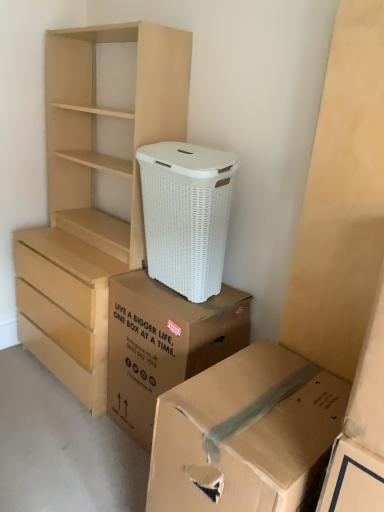
Question: Does cardboard box at lower right, the 1th box from the front, have a smaller size compared to white wicker laundry basket at center?

Choices:
 (A) yes
 (B) no

Answer: (B)

Question: Is cardboard box at lower right, the 1th box from the front, facing away from white wicker laundry basket at center?

Choices:
 (A) yes
 (B) no

Answer: (B)

Question: Can you confirm if cardboard box at lower right, acting as the second box starting from the back, is taller than white wicker laundry basket at center?

Choices:
 (A) yes
 (B) no

Answer: (A)

Question: Is cardboard box at lower right, the 1th box from the front, completely or partially outside of white wicker laundry basket at center?

Choices:
 (A) no
 (B) yes

Answer: (B)

Question: Is the depth of cardboard box at lower right, the 1th box from the front, less than that of white wicker laundry basket at center?

Choices:
 (A) no
 (B) yes

Answer: (B)

Question: Looking at their shapes, would you say cardboard box at lower right, acting as the second box starting from the back, is wider or thinner than brown cardboard box at lower center, which ranks as the first box in back-to-front order?

Choices:
 (A) thin
 (B) wide

Answer: (B)

Question: Is point (178, 461) positioned closer to the camera than point (243, 346)?

Choices:
 (A) closer
 (B) farther

Answer: (A)

Question: Based on their sizes in the image, would you say cardboard box at lower right, acting as the second box starting from the back, is bigger or smaller than brown cardboard box at lower center, which is the second box from front to back?

Choices:
 (A) small
 (B) big

Answer: (B)

Question: From their relative heights in the image, would you say cardboard box at lower right, the 1th box from the front, is taller or shorter than brown cardboard box at lower center, which ranks as the first box in back-to-front order?

Choices:
 (A) short
 (B) tall

Answer: (B)

Question: From the image's perspective, relative to light brown wood chest of drawers at left, is cardboard box at lower right, acting as the second box starting from the back, above or below?

Choices:
 (A) below
 (B) above

Answer: (A)

Question: Considering the positions of point (261, 353) and point (137, 76), is point (261, 353) closer or farther from the camera than point (137, 76)?

Choices:
 (A) farther
 (B) closer

Answer: (B)

Question: In terms of size, does cardboard box at lower right, the 1th box from the front, appear bigger or smaller than light brown wood chest of drawers at left?

Choices:
 (A) big
 (B) small

Answer: (B)

Question: Based on their positions, is cardboard box at lower right, the 1th box from the front, located to the left or right of light brown wood chest of drawers at left?

Choices:
 (A) right
 (B) left

Answer: (A)

Question: From the image's perspective, relative to white wicker laundry basket at center, is light brown wood chest of drawers at left above or below?

Choices:
 (A) below
 (B) above

Answer: (B)

Question: Is point (132, 179) positioned closer to the camera than point (182, 219)?

Choices:
 (A) farther
 (B) closer

Answer: (A)